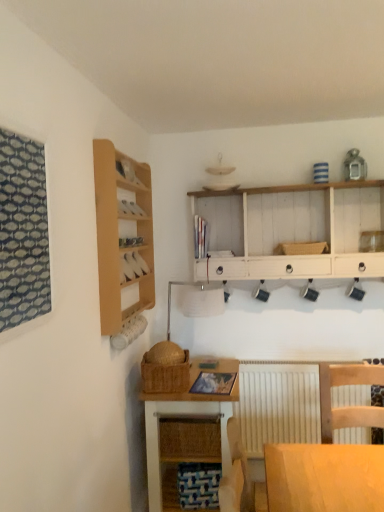
Question: From the image's perspective, is woven brown basket at lower center, which is counted as the 2th basket, starting from the top, located above patterned fabric window at left?

Choices:
 (A) no
 (B) yes

Answer: (A)

Question: Is woven brown basket at lower center, marked as the 2th basket in a right-to-left arrangement, looking in the opposite direction of patterned fabric window at left?

Choices:
 (A) no
 (B) yes

Answer: (A)

Question: From a real-world perspective, does woven brown basket at lower center, the 2th basket when ordered from back to front, stand above patterned fabric window at left?

Choices:
 (A) yes
 (B) no

Answer: (B)

Question: Considering the relative sizes of woven brown basket at lower center, which is the 1th basket from left to right, and patterned fabric window at left in the image provided, is woven brown basket at lower center, which is the 1th basket from left to right, thinner than patterned fabric window at left?

Choices:
 (A) yes
 (B) no

Answer: (B)

Question: Does woven brown basket at lower center, marked as the 1th basket in a front-to-back arrangement, have a greater width compared to patterned fabric window at left?

Choices:
 (A) no
 (B) yes

Answer: (B)

Question: Is woven brown basket at lower center, the 1th basket ordered from the bottom, not inside patterned fabric window at left?

Choices:
 (A) no
 (B) yes

Answer: (B)

Question: From a real-world perspective, is woven wood desk at lower center over white matte radiator at lower center?

Choices:
 (A) yes
 (B) no

Answer: (B)

Question: Is woven wood desk at lower center oriented towards white matte radiator at lower center?

Choices:
 (A) yes
 (B) no

Answer: (A)

Question: From the image's perspective, is woven wood desk at lower center under white matte radiator at lower center?

Choices:
 (A) no
 (B) yes

Answer: (B)

Question: Considering the relative positions of woven wood desk at lower center and white matte radiator at lower center in the image provided, is woven wood desk at lower center to the left of white matte radiator at lower center from the viewer's perspective?

Choices:
 (A) yes
 (B) no

Answer: (A)

Question: Considering the relative positions of woven wood desk at lower center and white matte radiator at lower center in the image provided, is woven wood desk at lower center to the right of white matte radiator at lower center from the viewer's perspective?

Choices:
 (A) no
 (B) yes

Answer: (A)

Question: Does woven wood desk at lower center have a greater width compared to white matte radiator at lower center?

Choices:
 (A) no
 (B) yes

Answer: (B)

Question: Is wooden cabinet at upper left not within white painted wood shelf at upper center?

Choices:
 (A) yes
 (B) no

Answer: (A)